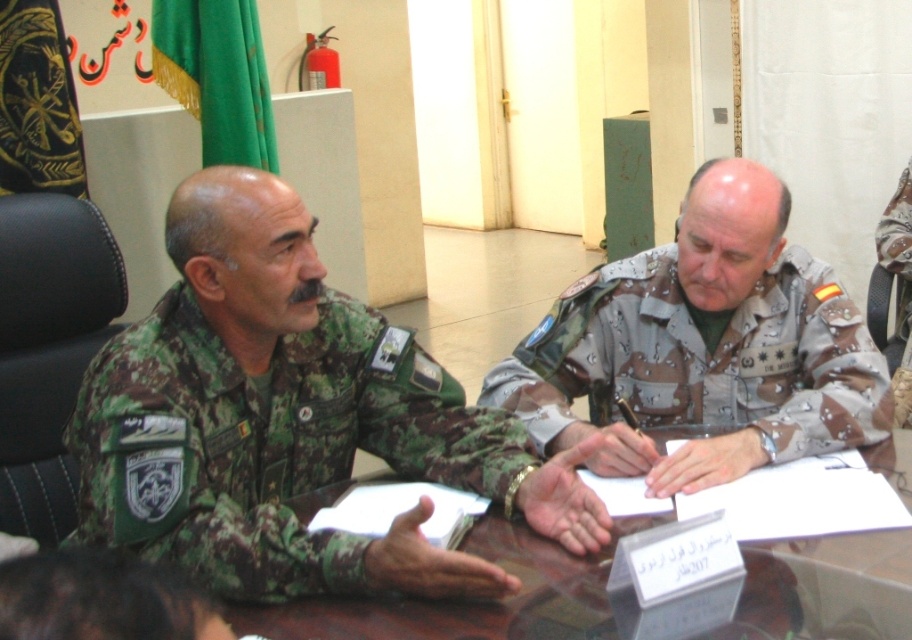
Question: Which point is closer to the camera taking this photo?

Choices:
 (A) (814, 557)
 (B) (280, 552)

Answer: (B)

Question: Is camouflage uniform at left above camouflage fabric uniform at center?

Choices:
 (A) no
 (B) yes

Answer: (A)

Question: Estimate the real-world distances between objects in this image. Which object is farther from the camouflage uniform at left?

Choices:
 (A) transparent glass table at center
 (B) camouflage fabric uniform at center

Answer: (B)

Question: Is camouflage uniform at left wider than transparent glass table at center?

Choices:
 (A) yes
 (B) no

Answer: (B)

Question: Among these points, which one is nearest to the camera?

Choices:
 (A) (623, 348)
 (B) (485, 486)

Answer: (B)

Question: Can you confirm if camouflage uniform at left is smaller than transparent glass table at center?

Choices:
 (A) no
 (B) yes

Answer: (A)